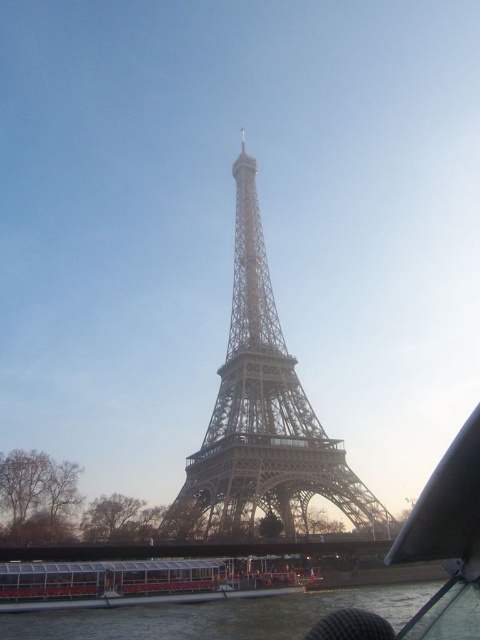
Question: Estimate the real-world distances between objects in this image. Which object is closer to the metallic structure at center?

Choices:
 (A) transparent glass water at lower center
 (B) white plastic boat at lower center

Answer: (B)

Question: Among these objects, which one is farthest from the camera?

Choices:
 (A) white plastic boat at lower center
 (B) transparent glass water at lower center
 (C) metallic structure at center

Answer: (A)

Question: Is metallic structure at center in front of transparent glass water at lower center?

Choices:
 (A) yes
 (B) no

Answer: (A)

Question: Is metallic structure at center further to camera compared to transparent glass water at lower center?

Choices:
 (A) yes
 (B) no

Answer: (B)

Question: From the image, what is the correct spatial relationship of metallic structure at center in relation to transparent glass water at lower center?

Choices:
 (A) below
 (B) above

Answer: (B)

Question: Which of the following is the closest to the observer?

Choices:
 (A) metallic structure at center
 (B) transparent glass water at lower center

Answer: (A)